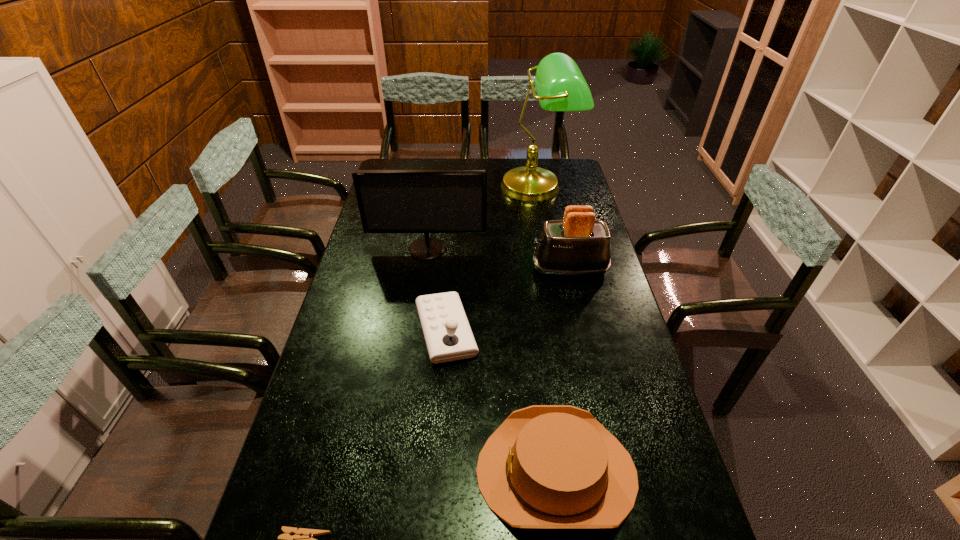
Image resolution: width=960 pixels, height=540 pixels. I want to click on the tallest object, so click(560, 86).

The height and width of the screenshot is (540, 960). What are the coordinates of `lamp` in the screenshot? It's located at (560, 86).

The image size is (960, 540). Identify the location of the second tallest object. (390, 201).

Locate an element on the screen. the third tallest object is located at coordinates (578, 245).

In order to click on joystick in this screenshot , I will do `click(448, 336)`.

Where is `the fourth farthest object`? the fourth farthest object is located at coordinates (448, 336).

Identify the location of cowboy hat. (546, 466).

In order to click on free space located on the desk next to the lamp in this screenshot , I will do pyautogui.click(x=544, y=225).

Find the location of a particular element. vacant space located 0.400m on the front-facing side of the computer monitor is located at coordinates (413, 347).

Identify the location of free space located on the side of the toaster with the control lever. (494, 269).